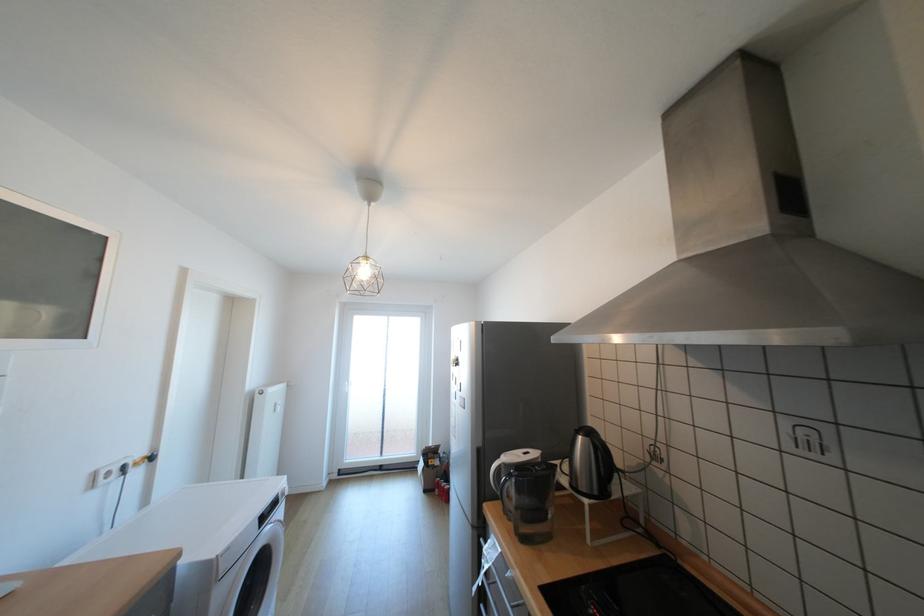
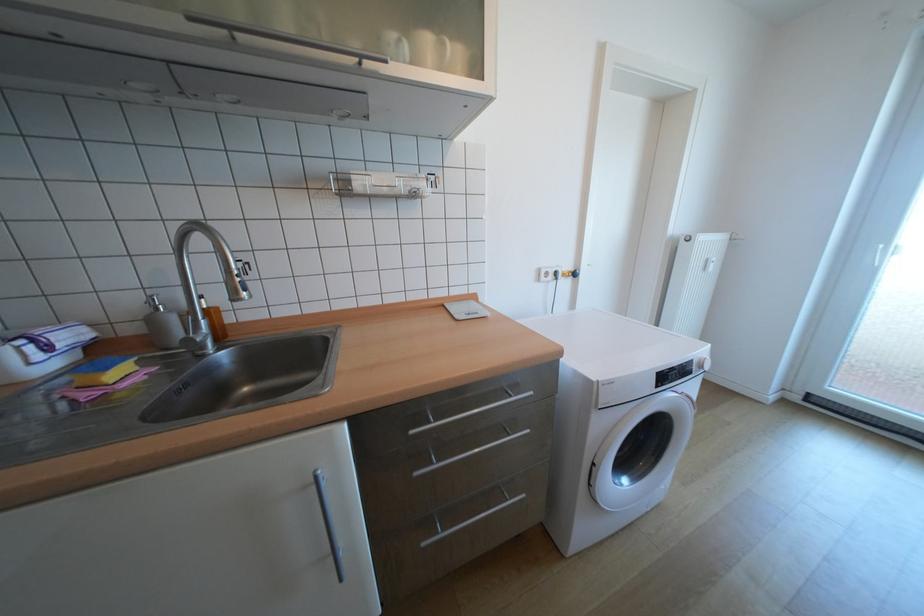
How did the camera likely rotate?

The camera rotated toward left-down.